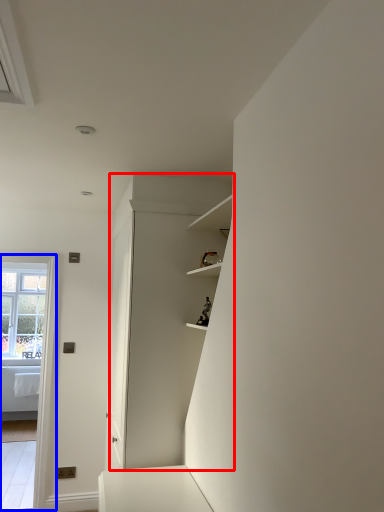
Question: Which of the following is the closest to the observer, dresser (highlighted by a red box) or glass door (highlighted by a blue box)?

Choices:
 (A) dresser
 (B) glass door

Answer: (A)